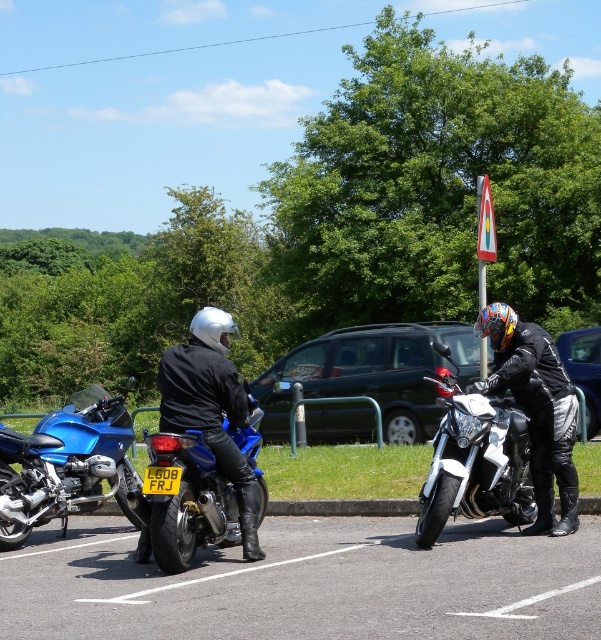
Question: Which object is the farthest from the black matte van at center?

Choices:
 (A) blue metallic motorcycle at center
 (B) black rubber motorcycle at lower center

Answer: (A)

Question: Based on their relative distances, which object is farther from the blue metallic motorcycle at left?

Choices:
 (A) black matte van at center
 (B) blue metallic motorcycle at center
 (C) black matte car at center
 (D) white glossy motorcycle at center

Answer: (C)

Question: Which point appears farthest from the camera in this image?

Choices:
 (A) (594, 326)
 (B) (349, 330)

Answer: (A)

Question: In this image, where is matte black motorcycle at right located relative to blue metallic motorcycle at center?

Choices:
 (A) above
 (B) below

Answer: (A)

Question: Is blue metallic motorcycle at left further to camera compared to black matte car at center?

Choices:
 (A) yes
 (B) no

Answer: (B)

Question: Is blue metallic motorcycle at left above black matte car at center?

Choices:
 (A) yes
 (B) no

Answer: (B)